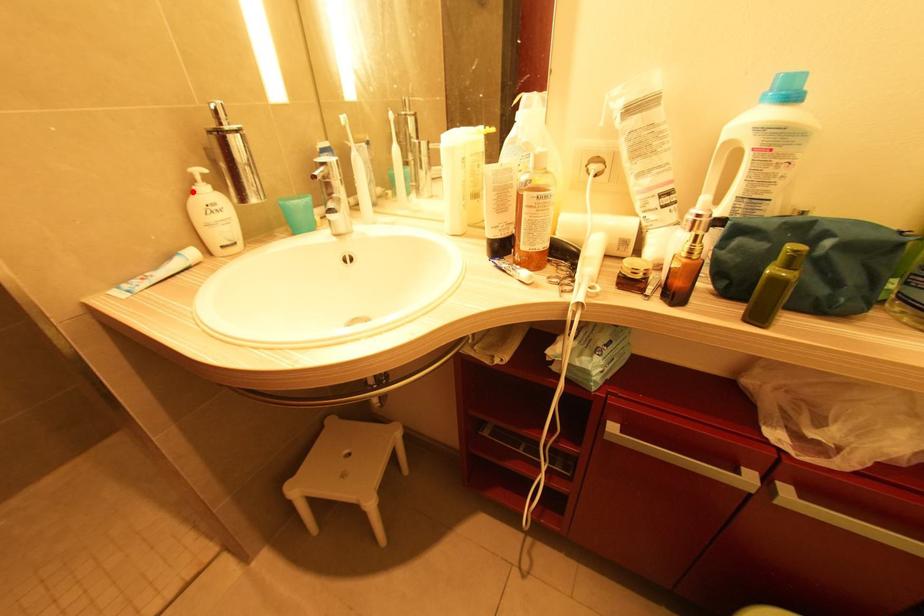
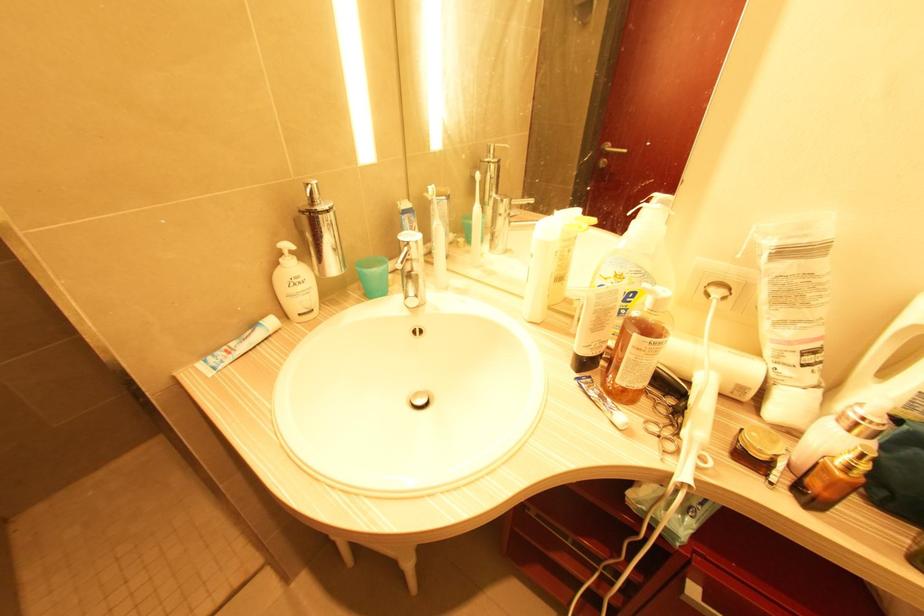
In the second image, find the point that corresponds to the highlighted location in the first image.

(280, 265)